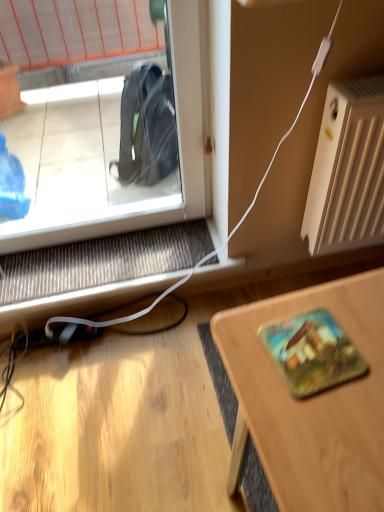
This screenshot has width=384, height=512. What do you see at coordinates (348, 170) in the screenshot? I see `white matte radiator at right` at bounding box center [348, 170].

Where is `white matte radiator at right`? This screenshot has width=384, height=512. white matte radiator at right is located at coordinates (348, 170).

Describe the element at coordinates (311, 402) in the screenshot. This screenshot has width=384, height=512. I see `wooden desk at lower right` at that location.

Measure the distance between point (377,321) and camera.

Point (377,321) and camera are 21.18 inches apart.

Find the location of a particular element. This screenshot has height=512, width=384. wooden desk at lower right is located at coordinates (311, 402).

This screenshot has width=384, height=512. Find the location of `white matte radiator at right`. white matte radiator at right is located at coordinates (348, 170).

Considering the positions of objects wooden desk at lower right and white matte radiator at right in the image provided, who is more to the left, wooden desk at lower right or white matte radiator at right?

Positioned to the left is wooden desk at lower right.

Which is behind, wooden desk at lower right or white matte radiator at right?

Positioned behind is white matte radiator at right.

Which is in front, point (239, 410) or point (362, 128)?

The point (362, 128) is closer to the camera.

From the image's perspective, which object appears higher, wooden desk at lower right or white matte radiator at right?

white matte radiator at right.

From a real-world perspective, between wooden desk at lower right and white matte radiator at right, who is vertically higher?

In real-world perspective, white matte radiator at right is above.

Consider the image. Is wooden desk at lower right wider than white matte radiator at right?

Correct, the width of wooden desk at lower right exceeds that of white matte radiator at right.

Considering the sizes of objects wooden desk at lower right and white matte radiator at right in the image provided, who is shorter, wooden desk at lower right or white matte radiator at right?

Standing shorter between the two is white matte radiator at right.

Which of these two, wooden desk at lower right or white matte radiator at right, is bigger?

With larger size is wooden desk at lower right.

Is wooden desk at lower right surrounding white matte radiator at right?

No.

Is there a large distance between wooden desk at lower right and white matte radiator at right?

No, wooden desk at lower right is in close proximity to white matte radiator at right.

Is wooden desk at lower right turned away from white matte radiator at right?

No, wooden desk at lower right is not facing the opposite direction of white matte radiator at right.

Find the location of `radiator above the wooden desk at lower right (from the image's perspective)`. radiator above the wooden desk at lower right (from the image's perspective) is located at coordinates (348, 170).

Based on their positions, is white matte radiator at right located to the left or right of wooden desk at lower right?

In the image, white matte radiator at right appears on the right side of wooden desk at lower right.

Who is more distant, white matte radiator at right or wooden desk at lower right?

white matte radiator at right is further from the camera.

Is point (366, 229) closer or farther from the camera than point (326, 421)?

Point (366, 229) is positioned farther from the camera compared to point (326, 421).

From the image's perspective, which is below, white matte radiator at right or wooden desk at lower right?

From the image's view, wooden desk at lower right is below.

From a real-world perspective, which is physically above, white matte radiator at right or wooden desk at lower right?

white matte radiator at right.

Looking at their sizes, would you say white matte radiator at right is wider or thinner than wooden desk at lower right?

white matte radiator at right is thinner than wooden desk at lower right.

Does white matte radiator at right have a lesser height compared to wooden desk at lower right?

Yes, white matte radiator at right is shorter than wooden desk at lower right.

In the scene shown: Looking at the image, does white matte radiator at right seem bigger or smaller compared to wooden desk at lower right?

Clearly, white matte radiator at right is smaller in size than wooden desk at lower right.

Is wooden desk at lower right completely or partially inside white matte radiator at right?

No, wooden desk at lower right is not inside white matte radiator at right.

Is white matte radiator at right next to wooden desk at lower right?

No, white matte radiator at right is not beside wooden desk at lower right.

Does white matte radiator at right turn towards wooden desk at lower right?

Yes, white matte radiator at right is aimed at wooden desk at lower right.

What's the angular difference between white matte radiator at right and wooden desk at lower right's facing directions?

The facing directions of white matte radiator at right and wooden desk at lower right are 86.1 degrees apart.

How distant is white matte radiator at right from wooden desk at lower right?

white matte radiator at right and wooden desk at lower right are 64.82 centimeters apart from each other.

At what (x,y) coordinates should I click in order to perform the action: click on radiator above the wooden desk at lower right (from the image's perspective). Please return your answer as a coordinate pair (x, y). Image resolution: width=384 pixels, height=512 pixels. Looking at the image, I should click on (348, 170).

Locate an element on the screen. The image size is (384, 512). desk on the left of the white matte radiator at right is located at coordinates (311, 402).

Where is `desk that is below the white matte radiator at right (from the image's perspective)`? desk that is below the white matte radiator at right (from the image's perspective) is located at coordinates (311, 402).